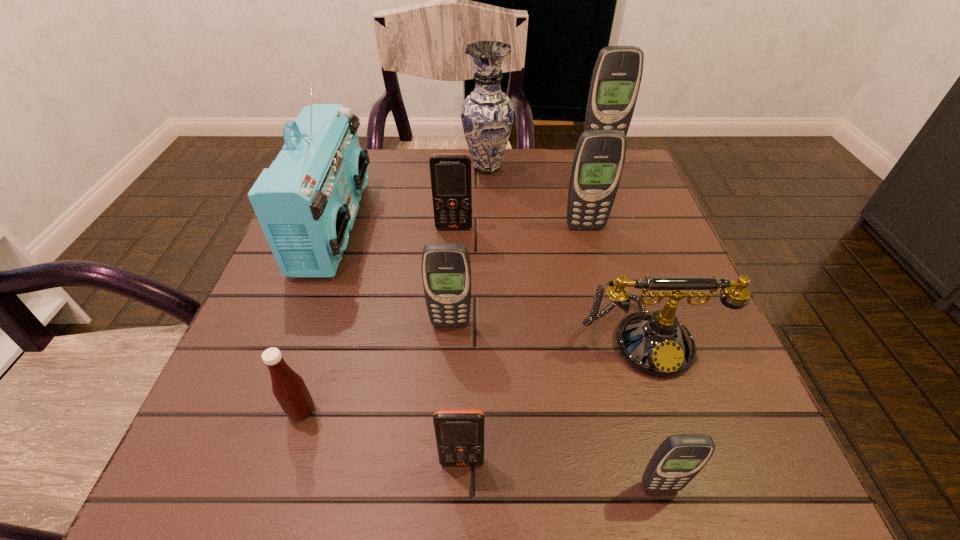
In order to click on blue vase in this screenshot , I will do `click(487, 115)`.

Identify the location of blue radio receiver. The height and width of the screenshot is (540, 960). (306, 202).

Identify the location of the farthest gray cellular telephone. This screenshot has height=540, width=960. (616, 78).

You are a GUI agent. You are given a task and a screenshot of the screen. Output one action in this format:
    pyautogui.click(x=<x>, y=<y>)
    Task: Click on the tallest cellular telephone
    
    Given the screenshot: What is the action you would take?
    pyautogui.click(x=616, y=78)

Where is `the seventh shortest object`? This screenshot has height=540, width=960. the seventh shortest object is located at coordinates (598, 162).

Where is `the third nearest gray cellular telephone`? This screenshot has width=960, height=540. the third nearest gray cellular telephone is located at coordinates (598, 162).

The width and height of the screenshot is (960, 540). Identify the location of the third biggest gray cellular telephone. (446, 269).

At what (x,y) coordinates should I click in order to perform the action: click on the leftmost gray cellular telephone. Please return your answer as a coordinate pair (x, y). The width and height of the screenshot is (960, 540). Looking at the image, I should click on (446, 269).

The image size is (960, 540). In order to click on the farther orange cellular telephone in this screenshot , I will do `click(451, 182)`.

Find the location of a particular element. black telephone is located at coordinates (655, 343).